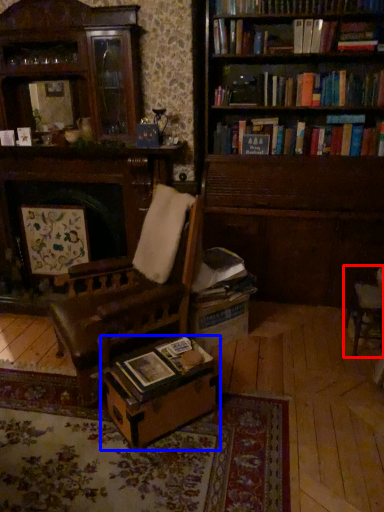
Question: Which object appears farthest to the camera in this image, chair (highlighted by a red box) or table (highlighted by a blue box)?

Choices:
 (A) chair
 (B) table

Answer: (A)